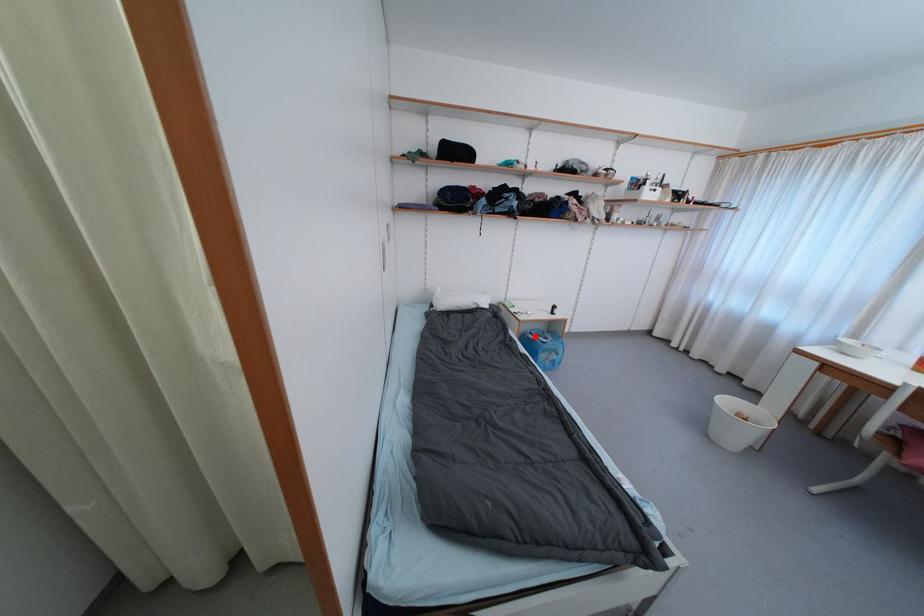
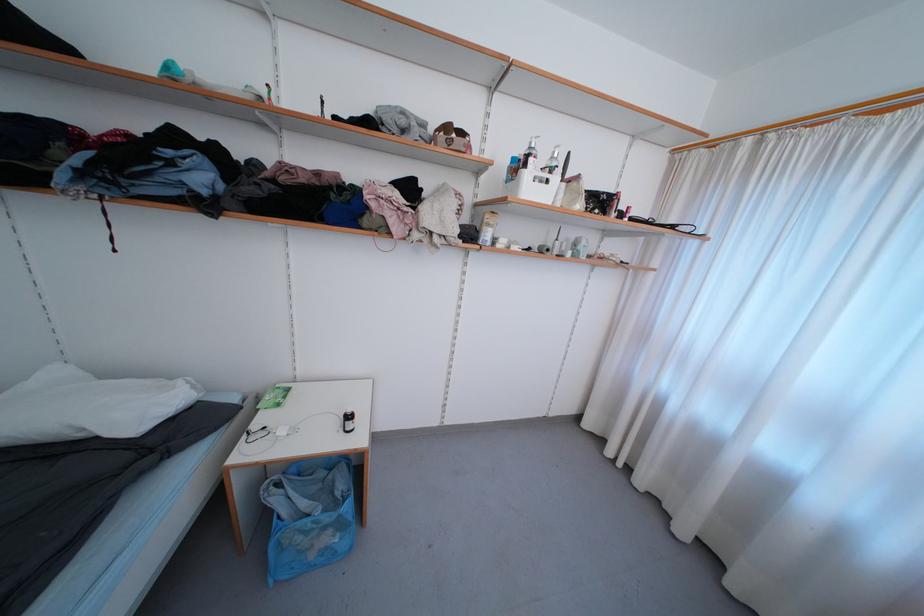
Find the pixel in the second image that matches the highlighted location in the first image.

(284, 488)